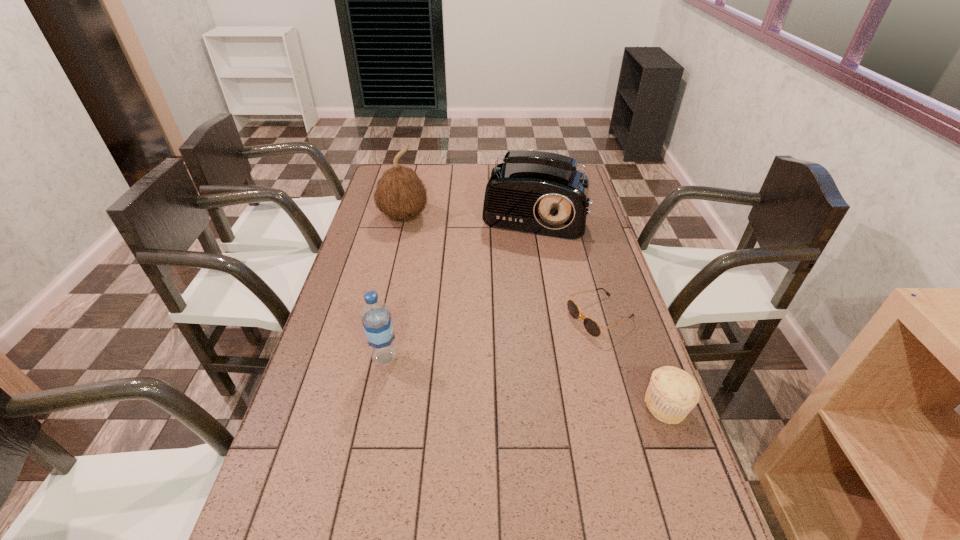
Find the location of a particular element. vacant region between the sunglasses and the radio receiver is located at coordinates (566, 263).

Image resolution: width=960 pixels, height=540 pixels. What are the coordinates of `blank region between the shortest object and the coconut` in the screenshot? It's located at (502, 267).

Where is `free point between the coconut and the second nearest object`? free point between the coconut and the second nearest object is located at coordinates (395, 288).

Where is `free space between the sunglasses and the radio receiver`? free space between the sunglasses and the radio receiver is located at coordinates (566, 263).

Identify the location of free point between the radio receiver and the third farthest object. The width and height of the screenshot is (960, 540). (566, 263).

Find the location of `free space between the muffin and the coconut`. free space between the muffin and the coconut is located at coordinates (536, 312).

Locate an element on the screen. free space between the radio receiver and the nearest object is located at coordinates (599, 308).

What are the coordinates of `vacant region between the second nearest object and the coconut` in the screenshot? It's located at (395, 288).

You are a GUI agent. You are given a task and a screenshot of the screen. Output one action in this format:
    pyautogui.click(x=<x>, y=<y>)
    Task: Click on the empty space between the fourth tallest object and the coconut
    
    Given the screenshot: What is the action you would take?
    [536, 312]

The height and width of the screenshot is (540, 960). In order to click on free space between the coconut and the nearest object in this screenshot , I will do `click(536, 312)`.